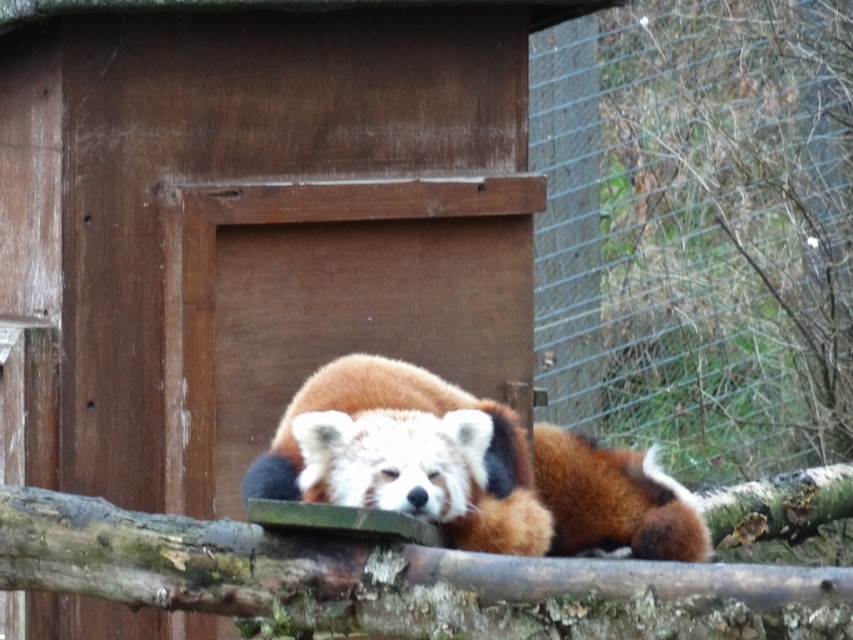
Question: Which point appears farthest from the camera in this image?

Choices:
 (A) (412, 611)
 (B) (312, 419)

Answer: (B)

Question: Which point is closer to the camera?

Choices:
 (A) (397, 499)
 (B) (120, 573)

Answer: (A)

Question: Is brown rough wood at center to the left of fuzzy reddish-brown red panda at center from the viewer's perspective?

Choices:
 (A) no
 (B) yes

Answer: (B)

Question: Which point is farther from the camera taking this photo?

Choices:
 (A) (347, 625)
 (B) (347, 452)

Answer: (B)

Question: Is brown rough wood at center smaller than fuzzy reddish-brown red panda at center?

Choices:
 (A) no
 (B) yes

Answer: (B)

Question: Does brown rough wood at center appear on the left side of fuzzy reddish-brown red panda at center?

Choices:
 (A) no
 (B) yes

Answer: (B)